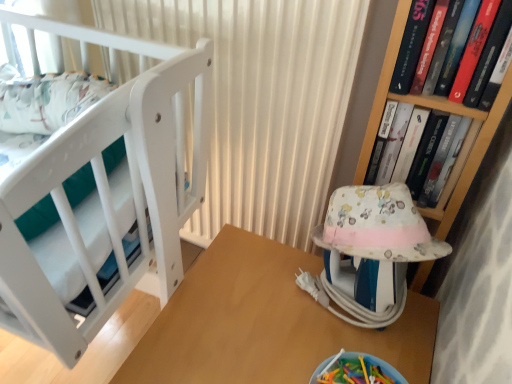
The image size is (512, 384). What are the coordinates of `free space to the left of fluffy fabric baby carriage at right` in the screenshot? It's located at (258, 291).